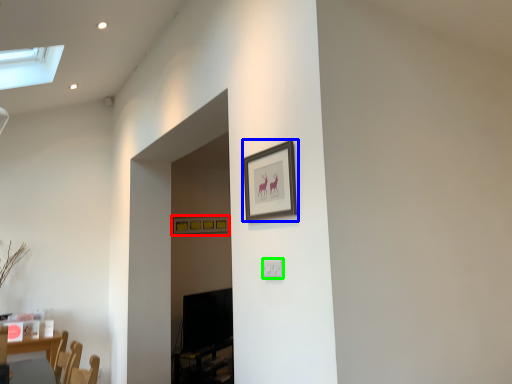
Question: Considering the real-world distances, which object is closest to picture frame (highlighted by a red box)? picture frame (highlighted by a blue box) or electric outlet (highlighted by a green box).

Choices:
 (A) picture frame
 (B) electric outlet

Answer: (A)